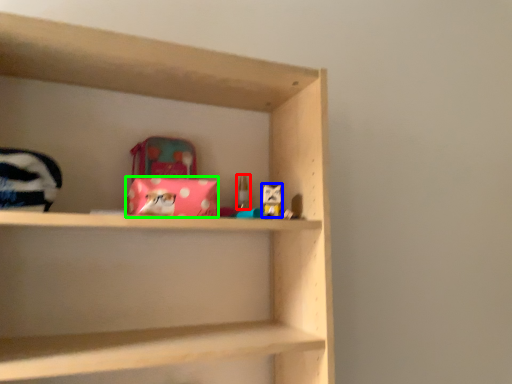
Question: Which object is the closest to the toy (highlighted by a red box)? Choose among these: toy (highlighted by a blue box) or material (highlighted by a green box).

Choices:
 (A) toy
 (B) material

Answer: (A)